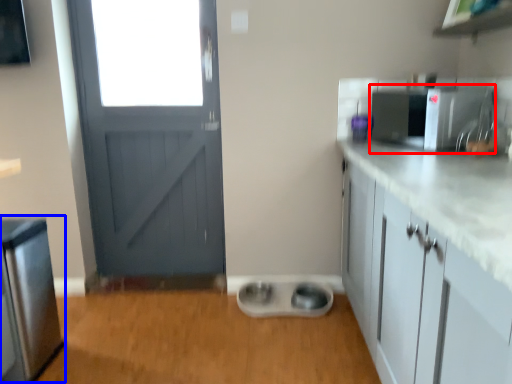
Question: Which point is further to the camera, appliance (highlighted by a red box) or appliance (highlighted by a blue box)?

Choices:
 (A) appliance
 (B) appliance

Answer: (A)